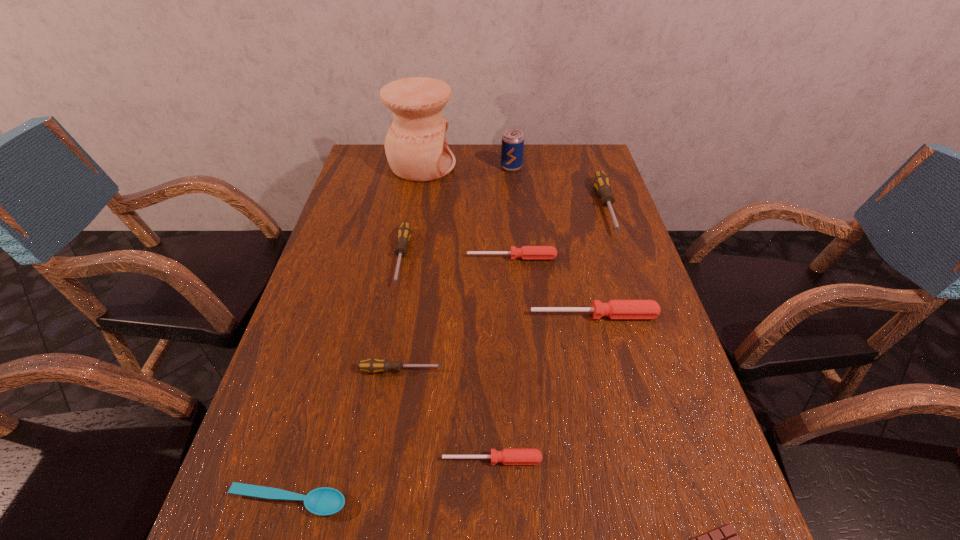
Locate an element on the screen. free point located on the back of the second biggest red screwdriver is located at coordinates (509, 213).

Find the location of a particular element. vacant space situated at the tip of the nearest gray screwdriver is located at coordinates (599, 370).

Find the location of a particular element. vacant region located 0.150m on the right of the smallest red screwdriver is located at coordinates (624, 460).

Where is `vacant point located on the right of the spoon`? vacant point located on the right of the spoon is located at coordinates (471, 502).

Identify the location of pottery present at the far edge. This screenshot has height=540, width=960. (416, 148).

The width and height of the screenshot is (960, 540). In order to click on beer can located in the far edge section of the desktop in this screenshot , I will do `click(512, 140)`.

This screenshot has height=540, width=960. I want to click on screwdriver positioned at the far edge, so click(601, 182).

You are a GUI agent. You are given a task and a screenshot of the screen. Output one action in this format:
    pyautogui.click(x=<x>, y=<y>)
    Task: Click on the pottery present at the left edge
    
    Given the screenshot: What is the action you would take?
    pyautogui.click(x=416, y=148)

Locate an element on the screen. spoon present at the left edge is located at coordinates (324, 501).

Locate an element on the screen. The image size is (960, 540). object at the far left corner is located at coordinates (416, 148).